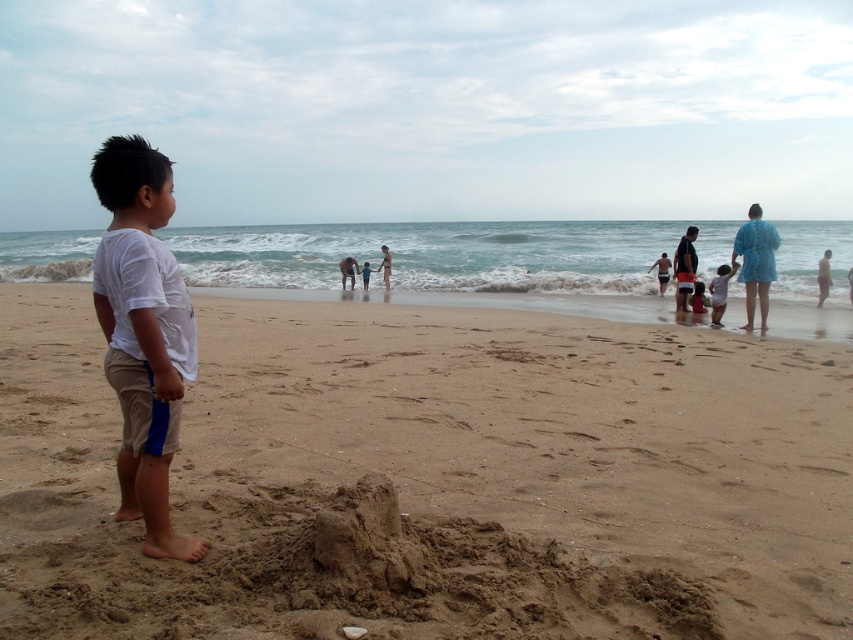
Question: Can you confirm if blue fabric dress at center-right is smaller than blue fabric swimsuit at center?

Choices:
 (A) no
 (B) yes

Answer: (A)

Question: Which of the following is the closest to the observer?

Choices:
 (A) (125, 444)
 (B) (347, 275)

Answer: (A)

Question: Among these points, which one is farthest from the camera?

Choices:
 (A) (756, 216)
 (B) (363, 282)

Answer: (B)

Question: Among these points, which one is nearest to the camera?

Choices:
 (A) 345,280
 (B) 694,275

Answer: (B)

Question: Can you confirm if blue fabric shirt at right is smaller than matte pink shorts at lower right?

Choices:
 (A) no
 (B) yes

Answer: (B)

Question: Is blue fabric shirt at right below blue fabric swimsuit at center?

Choices:
 (A) yes
 (B) no

Answer: (A)